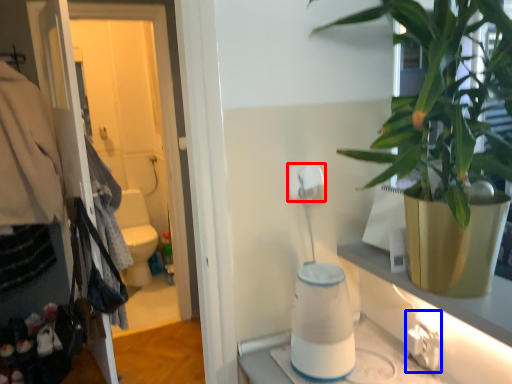
Question: Which point is further to the camera, toilet paper (highlighted by a red box) or electric outlet (highlighted by a blue box)?

Choices:
 (A) toilet paper
 (B) electric outlet

Answer: (A)